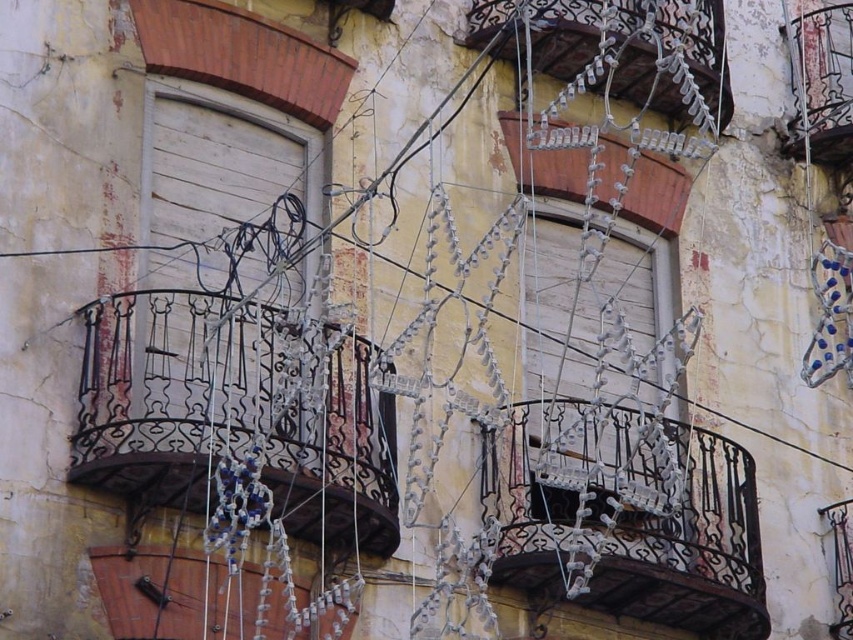
Describe the element at coordinates (563, 35) in the screenshot. I see `white metallic balcony at upper center` at that location.

You are a GUI agent. You are given a task and a screenshot of the screen. Output one action in this format:
    pyautogui.click(x=<x>, y=<y>)
    Task: Click on the white metallic balcony at upper center
    
    Given the screenshot: What is the action you would take?
    pyautogui.click(x=563, y=35)

Between rusty wrought iron balcony at center and white metallic balcony at upper center, which one has more height?

rusty wrought iron balcony at center is taller.

Between rusty wrought iron balcony at center and white metallic balcony at upper center, which one has less height?

white metallic balcony at upper center

What do you see at coordinates (689, 548) in the screenshot? I see `rusty wrought iron balcony at center` at bounding box center [689, 548].

Locate an element on the screen. This screenshot has width=853, height=640. rusty wrought iron balcony at center is located at coordinates (689, 548).

Is rusty wrought iron balcony at center positioned in front of wrought iron balcony at upper right?

Yes, rusty wrought iron balcony at center is closer to the viewer.

Identify the location of rusty wrought iron balcony at center. The height and width of the screenshot is (640, 853). (689, 548).